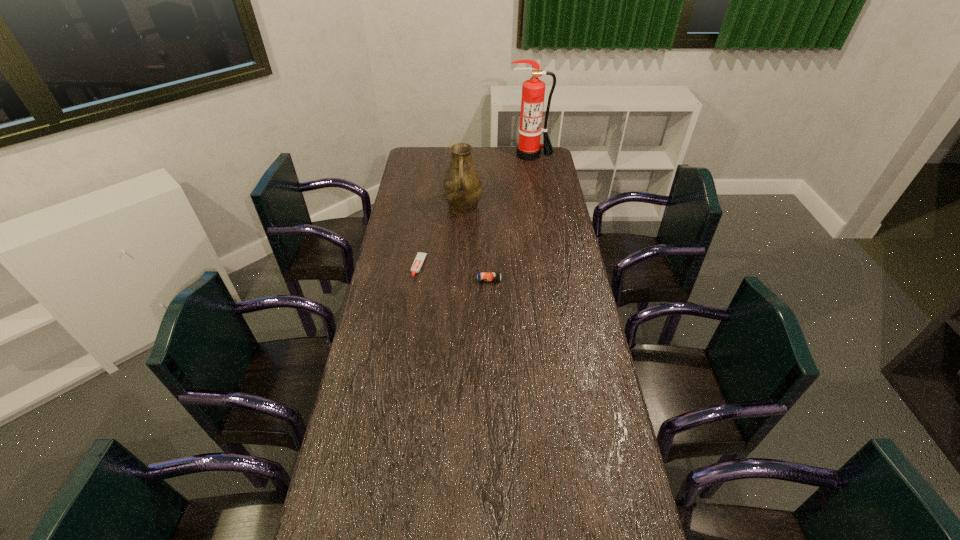
Identify the location of the farthest object. (533, 91).

The image size is (960, 540). Find the location of `the tallest object`. the tallest object is located at coordinates pyautogui.click(x=533, y=91).

Locate an element on the screen. pitcher is located at coordinates (462, 188).

Where is `the second farthest object`? The image size is (960, 540). the second farthest object is located at coordinates (462, 188).

Image resolution: width=960 pixels, height=540 pixels. In order to click on the second shortest object in this screenshot , I will do `click(481, 276)`.

Find the location of a particular element. the leftmost object is located at coordinates (416, 266).

Locate an element on the screen. the shortest object is located at coordinates (416, 266).

This screenshot has width=960, height=540. Find the location of `vacant space located at the nozzle of the tallest object`. vacant space located at the nozzle of the tallest object is located at coordinates (533, 171).

Locate an element on the screen. free space located 0.190m on the handle side of the second farthest object is located at coordinates (461, 248).

Identify the location of vacant space located on the back of the beer can. The width and height of the screenshot is (960, 540). (489, 254).